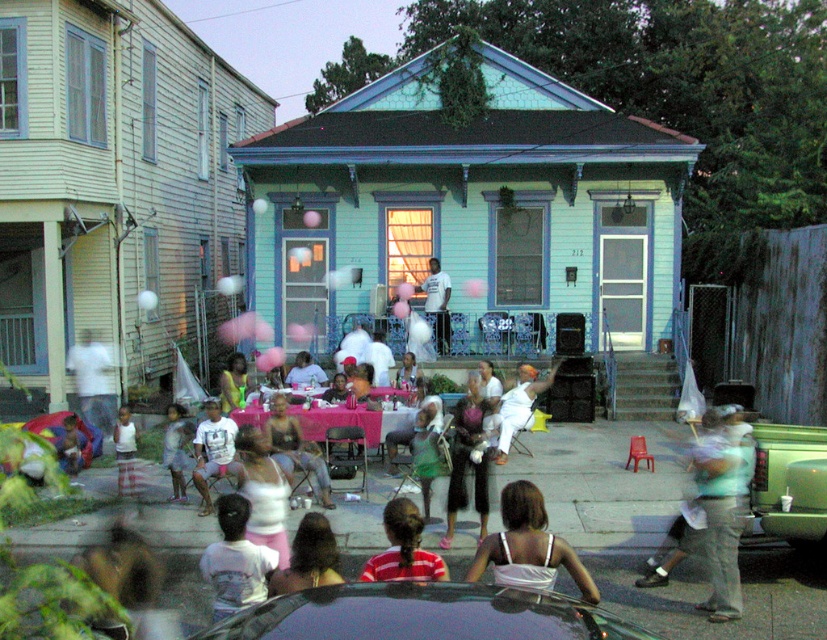
Who is shorter, metallic green car at lower right or red striped shirt at center?

red striped shirt at center

Is metallic green car at lower right positioned before red striped shirt at center?

No, it is behind red striped shirt at center.

This screenshot has height=640, width=827. Describe the element at coordinates (790, 481) in the screenshot. I see `metallic green car at lower right` at that location.

Identify the location of metallic green car at lower right. (790, 481).

Is metallic green car at lower right positioned before white fabric dress at center?

That is False.

Who is more distant from viewer, (768, 472) or (520, 490)?

The point (768, 472) is more distant.

Locate an element on the screen. metallic green car at lower right is located at coordinates (790, 481).

Is point (613, 616) positioned behind point (816, 483)?

No, (613, 616) is closer to viewer.

Which is behind, point (579, 621) or point (792, 477)?

The point (792, 477) is more distant.

Is point (562, 636) in front of point (777, 449)?

Yes, point (562, 636) is closer to viewer.

Identify the location of shiny black car at center. The image size is (827, 640). (422, 614).